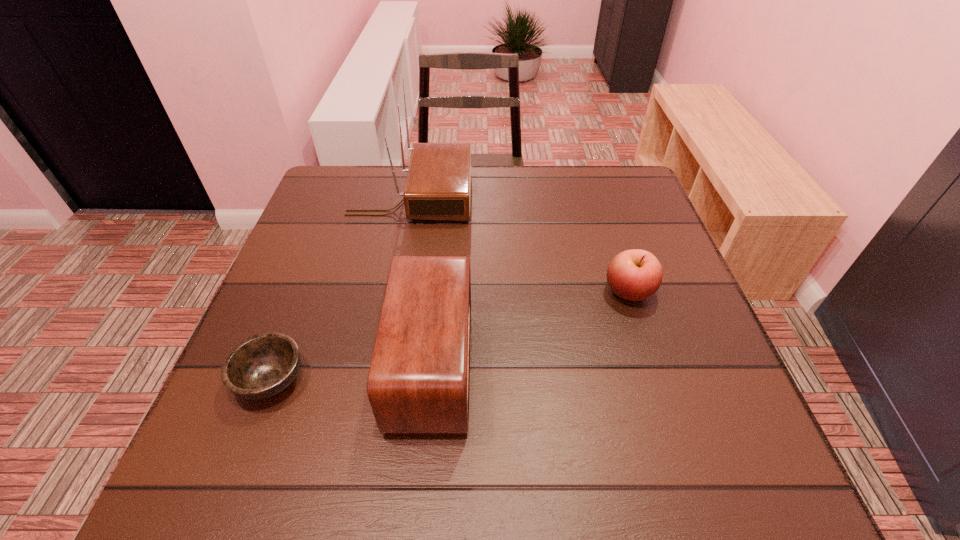
This screenshot has height=540, width=960. I want to click on vacant region that satisfies the following two spatial constraints: 1. on the front panel of the farthest object; 2. on the front side of the bowl, so click(376, 380).

Identify the location of vacant area that satisfies the following two spatial constraints: 1. on the front panel of the rightmost object; 2. on the right side of the taller radio receiver. This screenshot has height=540, width=960. (393, 292).